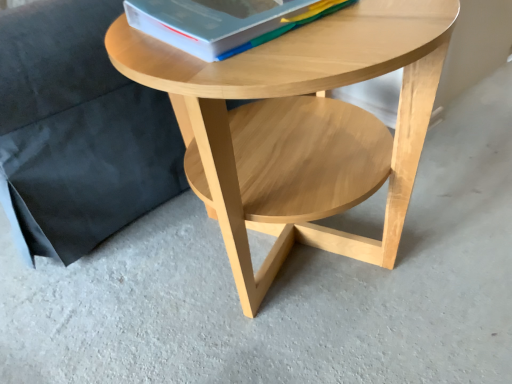
What are the coordinates of `blank space to the left of natural wood coffee table at center` in the screenshot? It's located at (111, 292).